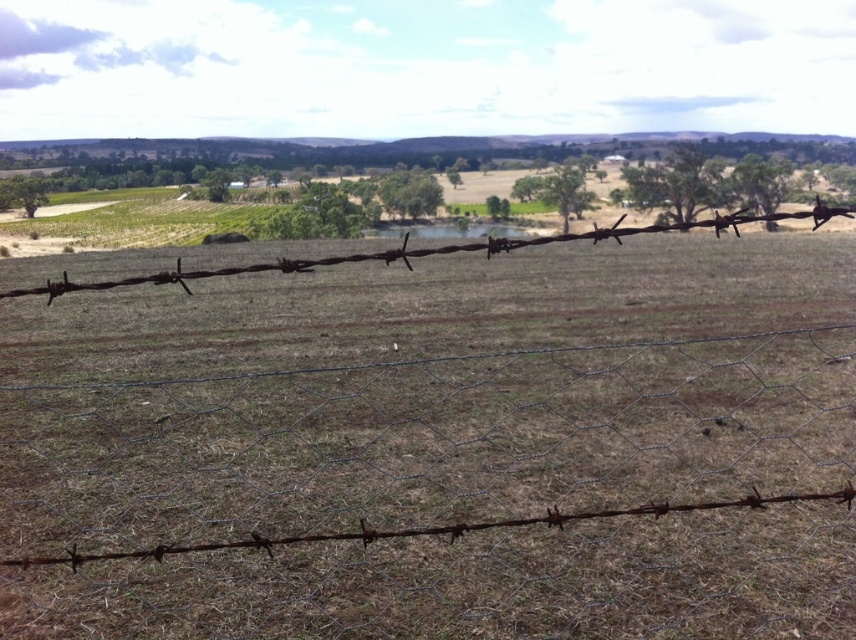
Question: Which point is farther to the camera?

Choices:
 (A) click(x=366, y=259)
 (B) click(x=524, y=259)

Answer: (B)

Question: Which of the following is the closest to the observer?

Choices:
 (A) (51, 285)
 (B) (498, 564)

Answer: (A)

Question: Which point is closer to the camera?

Choices:
 (A) (407, 374)
 (B) (194, 275)

Answer: (B)

Question: Does rusty wire fence at center appear under rusty wire at center?

Choices:
 (A) no
 (B) yes

Answer: (B)

Question: Is rusty wire fence at center further to the viewer compared to rusty wire at center?

Choices:
 (A) yes
 (B) no

Answer: (A)

Question: Is rusty wire fence at center further to camera compared to rusty wire at center?

Choices:
 (A) no
 (B) yes

Answer: (B)